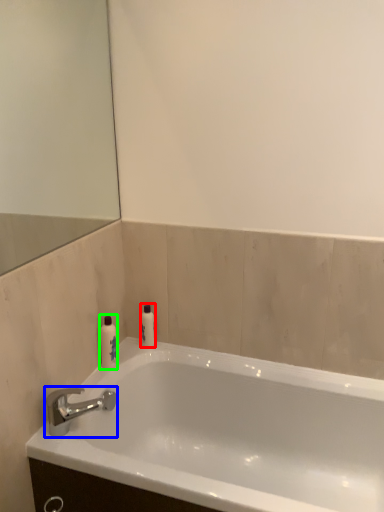
Question: Which is farther away from toiletry (highlighted by a red box)? tap (highlighted by a blue box) or toiletry (highlighted by a green box)?

Choices:
 (A) tap
 (B) toiletry

Answer: (A)